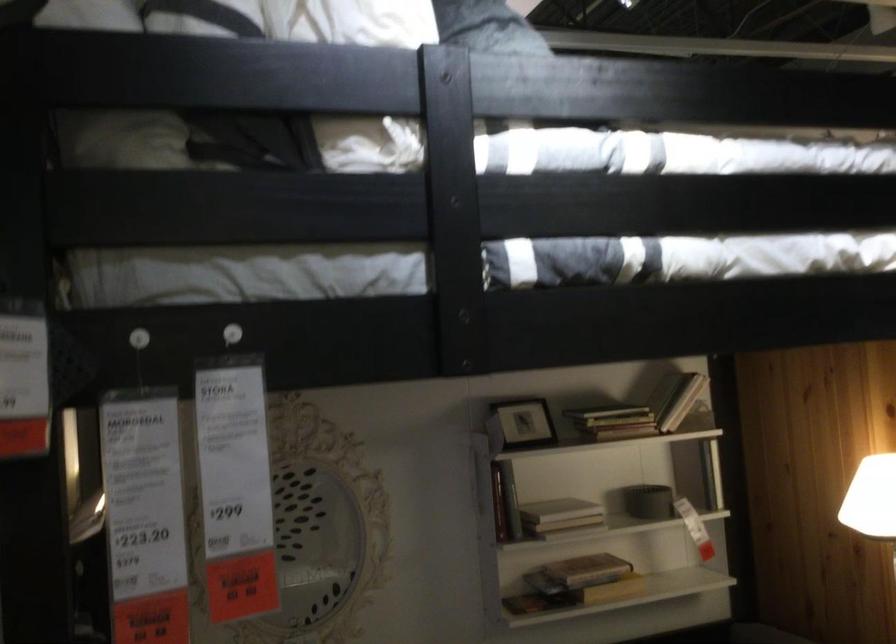
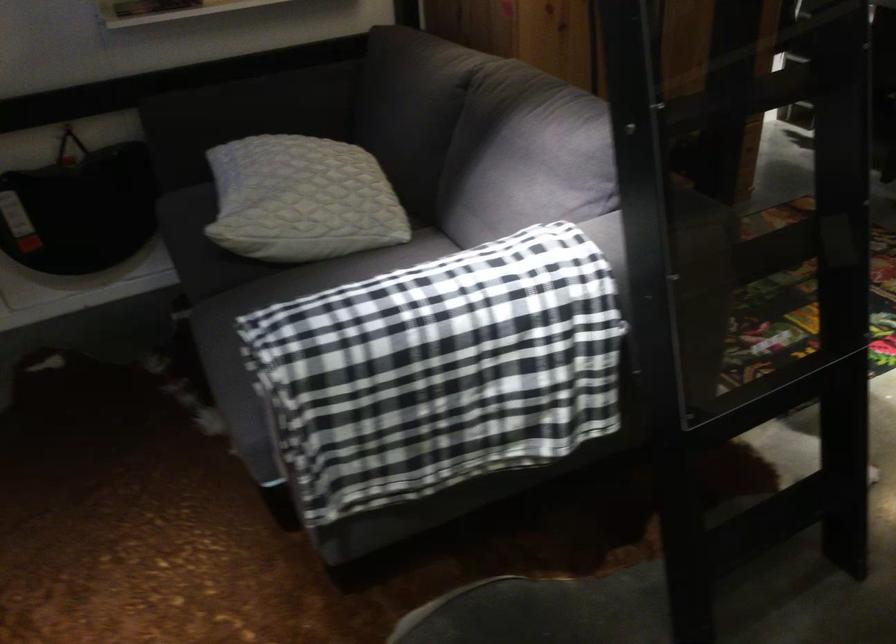
Question: How did the camera likely rotate?

Choices:
 (A) Left
 (B) Right
 (C) Up
 (D) Down

Answer: (D)